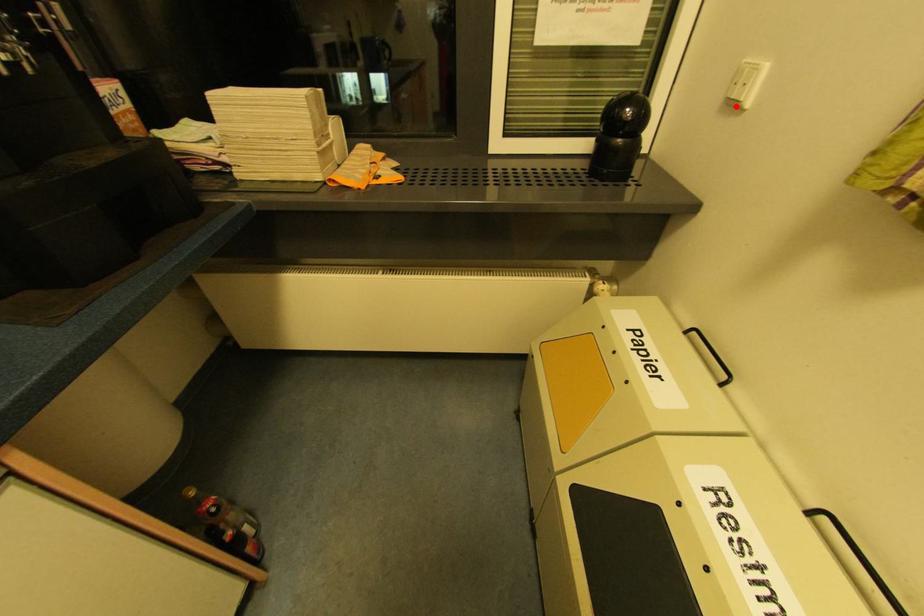
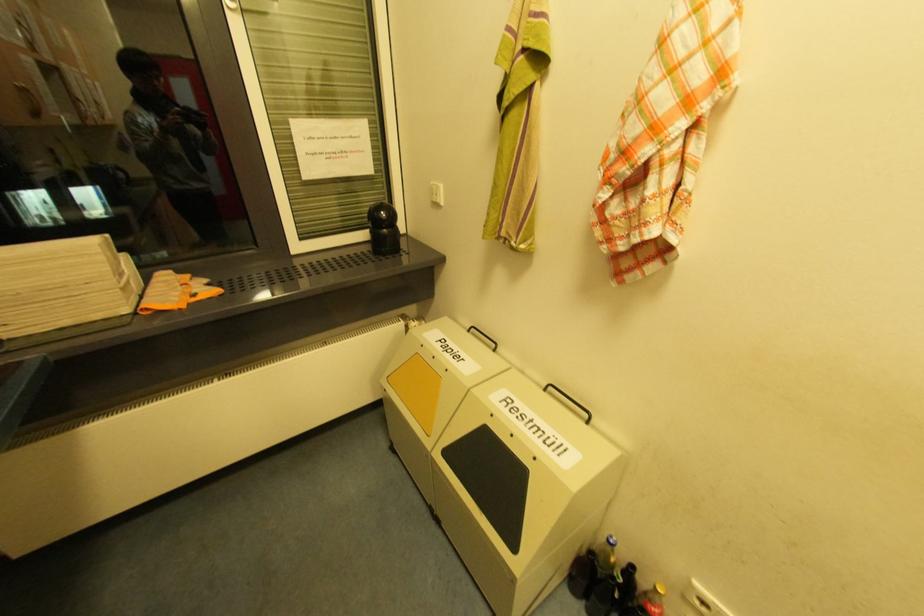
In the second image, find the point that corresponds to the highlighted location in the first image.

(440, 205)